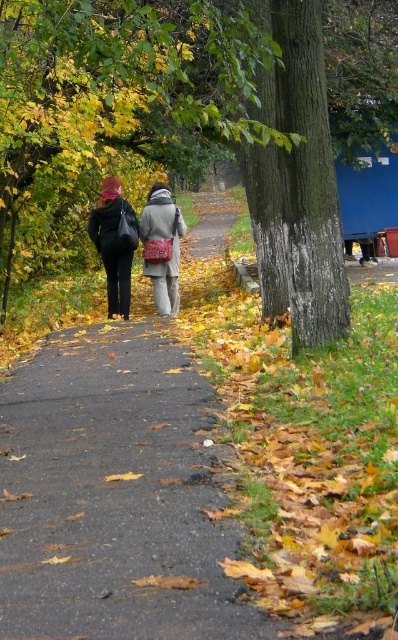
Which is more to the left, matte black coat at center or matte gray coat at center?

Positioned to the left is matte black coat at center.

Is matte black coat at center closer to camera compared to matte gray coat at center?

Yes, it is.

Identify the location of matte black coat at center. (134, 243).

This screenshot has height=640, width=398. I want to click on matte black coat at center, so click(134, 243).